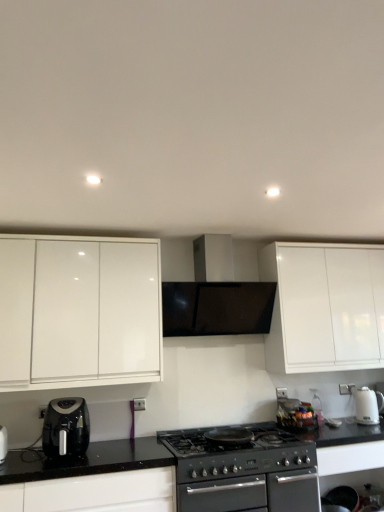
Question: Does black plastic air fryer at lower left, positioned as the second kitchen appliance in right-to-left order, contain white glossy electric kettle at right, placed as the 2th kitchen appliance when sorted from left to right?

Choices:
 (A) no
 (B) yes

Answer: (A)

Question: Can you see black plastic air fryer at lower left, marked as the first kitchen appliance in a front-to-back arrangement, touching white glossy electric kettle at right, which ranks as the first kitchen appliance in back-to-front order?

Choices:
 (A) yes
 (B) no

Answer: (B)

Question: Is black plastic air fryer at lower left, positioned as the second kitchen appliance in right-to-left order, located outside white glossy electric kettle at right, which ranks as the first kitchen appliance in back-to-front order?

Choices:
 (A) no
 (B) yes

Answer: (B)

Question: Is black plastic air fryer at lower left, the 2th kitchen appliance in the back-to-front sequence, to the left of white glossy electric kettle at right, which ranks as the 1th kitchen appliance in right-to-left order, from the viewer's perspective?

Choices:
 (A) yes
 (B) no

Answer: (A)

Question: Considering the relative sizes of black plastic air fryer at lower left, the 2th kitchen appliance in the back-to-front sequence, and white glossy electric kettle at right, the second kitchen appliance viewed from the front, in the image provided, is black plastic air fryer at lower left, the 2th kitchen appliance in the back-to-front sequence, wider than white glossy electric kettle at right, the second kitchen appliance viewed from the front,?

Choices:
 (A) no
 (B) yes

Answer: (B)

Question: Does point (76, 358) appear closer or farther from the camera than point (370, 415)?

Choices:
 (A) farther
 (B) closer

Answer: (B)

Question: Is white glossy cabinet at left taller or shorter than white glossy electric kettle at right, placed as the 2th kitchen appliance when sorted from left to right?

Choices:
 (A) tall
 (B) short

Answer: (A)

Question: Is white glossy cabinet at left bigger or smaller than white glossy electric kettle at right, which ranks as the first kitchen appliance in back-to-front order?

Choices:
 (A) big
 (B) small

Answer: (A)

Question: From a real-world perspective, is white glossy cabinet at left above or below white glossy electric kettle at right, which ranks as the 1th kitchen appliance in right-to-left order?

Choices:
 (A) below
 (B) above

Answer: (B)

Question: From a real-world perspective, is black granite countertop at lower left above or below black matte range hood at center?

Choices:
 (A) above
 (B) below

Answer: (B)

Question: Is black granite countertop at lower left wider or thinner than black matte range hood at center?

Choices:
 (A) wide
 (B) thin

Answer: (A)

Question: Is point (21, 468) closer or farther from the camera than point (180, 308)?

Choices:
 (A) farther
 (B) closer

Answer: (B)

Question: Is black granite countertop at lower left to the left or to the right of black matte range hood at center in the image?

Choices:
 (A) left
 (B) right

Answer: (A)

Question: From a real-world perspective, relative to black plastic air fryer at lower left, positioned as the second kitchen appliance in right-to-left order, is black matte stove at center vertically above or below?

Choices:
 (A) below
 (B) above

Answer: (A)

Question: Does point (304, 498) appear closer or farther from the camera than point (51, 443)?

Choices:
 (A) closer
 (B) farther

Answer: (B)